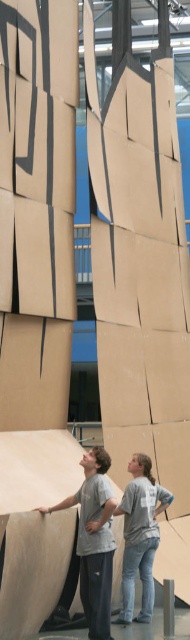
Question: Is matte gray skateboard at lower center wider than gray cotton t-shirt at center?

Choices:
 (A) yes
 (B) no

Answer: (B)

Question: Among these objects, which one is farthest from the camera?

Choices:
 (A) matte gray skateboard at lower center
 (B) gray cotton t-shirt at center

Answer: (B)

Question: Which object appears farthest from the camera in this image?

Choices:
 (A) matte gray skateboard at lower center
 (B) gray cotton t-shirt at center

Answer: (B)

Question: Is matte gray skateboard at lower center positioned in front of gray cotton t-shirt at center?

Choices:
 (A) yes
 (B) no

Answer: (A)

Question: Is matte gray skateboard at lower center wider than gray cotton t-shirt at center?

Choices:
 (A) no
 (B) yes

Answer: (A)